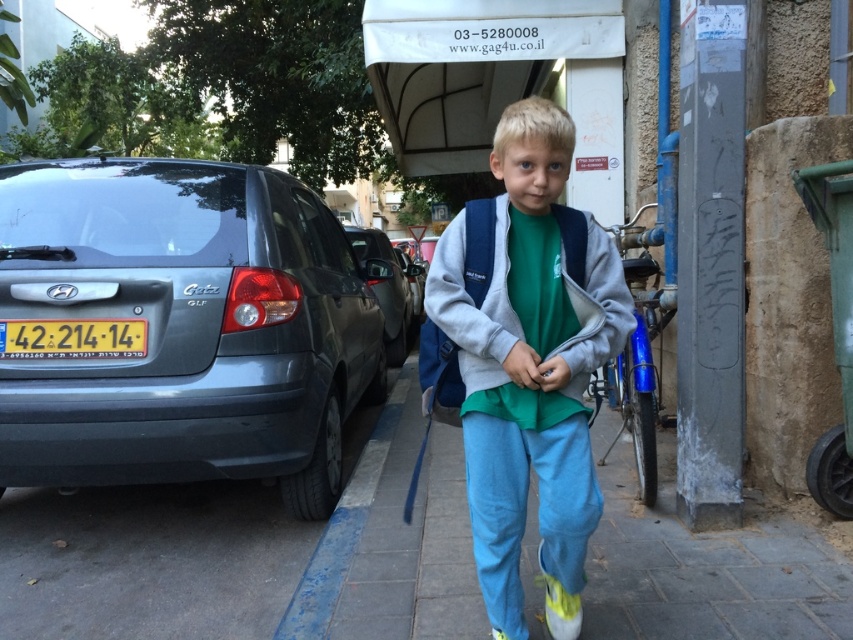
Does yellow plastic license plate at lower left have a larger size compared to metallic gray car at center?

Incorrect, yellow plastic license plate at lower left is not larger than metallic gray car at center.

Who is lower down, yellow plastic license plate at lower left or metallic gray car at center?

yellow plastic license plate at lower left is below.

Between point (39, 333) and point (418, 305), which one is positioned behind?

The point (418, 305) is behind.

You are a GUI agent. You are given a task and a screenshot of the screen. Output one action in this format:
    pyautogui.click(x=<x>, y=<y>)
    Task: Click on the yellow plastic license plate at lower left
    
    Given the screenshot: What is the action you would take?
    (x=73, y=339)

Does metallic gray car at center appear over yellow synthetic shoe at lower center?

Correct, metallic gray car at center is located above yellow synthetic shoe at lower center.

Who is positioned more to the right, metallic gray car at center or yellow synthetic shoe at lower center?

Positioned to the right is yellow synthetic shoe at lower center.

Which is behind, point (413, 289) or point (498, 636)?

The point (413, 289) is behind.

The image size is (853, 640). I want to click on metallic gray car at center, so click(x=412, y=282).

Consider the image. Who is lower down, matte gray car at left or yellow fabric shoe at lower center?

yellow fabric shoe at lower center

Which is in front, point (314, 472) or point (544, 593)?

Point (544, 593) is in front.

This screenshot has height=640, width=853. Identify the location of matte gray car at left. (184, 326).